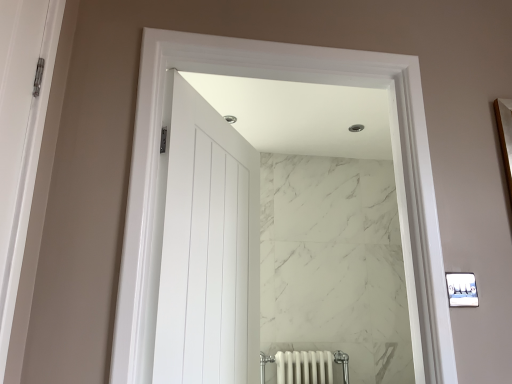
Question: Does point (215, 198) appear closer or farther from the camera than point (150, 112)?

Choices:
 (A) farther
 (B) closer

Answer: (A)

Question: Is white glossy door at center in front of or behind white marble wall at center in the image?

Choices:
 (A) front
 (B) behind

Answer: (B)

Question: From their relative heights in the image, would you say white glossy door at center is taller or shorter than white marble wall at center?

Choices:
 (A) tall
 (B) short

Answer: (A)

Question: Do you think white marble wall at center is within white glossy door at center, or outside of it?

Choices:
 (A) outside
 (B) inside

Answer: (A)

Question: In the image, is white marble wall at center on the left side or the right side of white glossy door at center?

Choices:
 (A) left
 (B) right

Answer: (B)

Question: Is white marble wall at center bigger or smaller than white glossy door at center?

Choices:
 (A) small
 (B) big

Answer: (A)

Question: Is white marble wall at center in front of or behind white glossy door at center in the image?

Choices:
 (A) behind
 (B) front

Answer: (B)